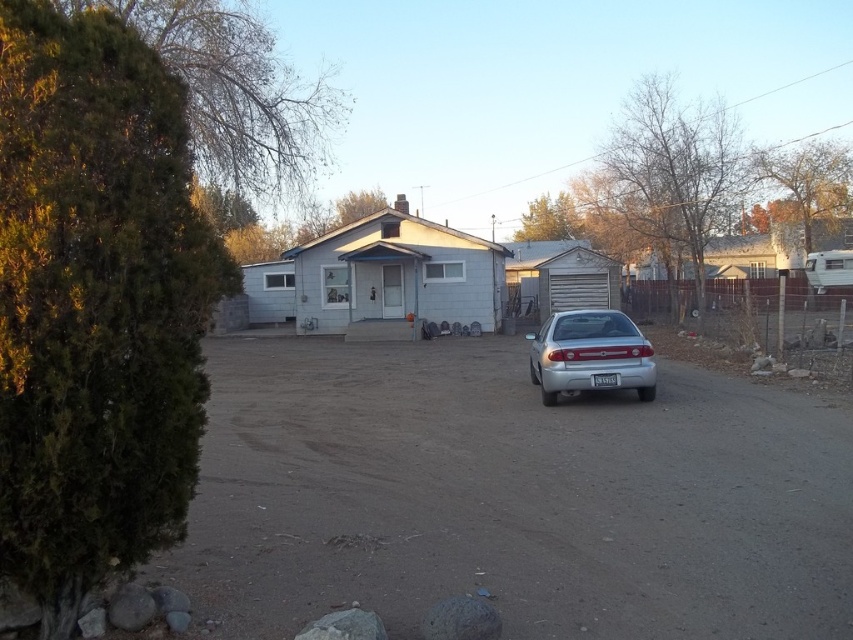
You are standing at the edge of the dirt track at center and want to walk to the silver metallic sedan at center. Which direction should you walk to get closer to the sedan?

You should walk away from the dirt track at center towards the silver metallic sedan at center since the sedan is farther away from you than the track.